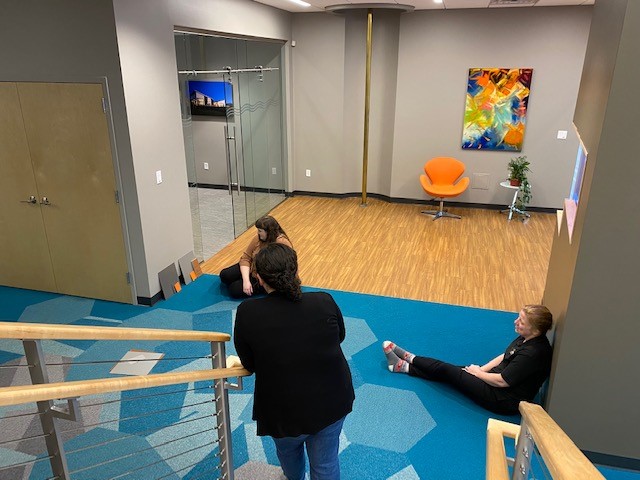
This screenshot has height=480, width=640. Find the location of `wood floor`. wood floor is located at coordinates (420, 251).